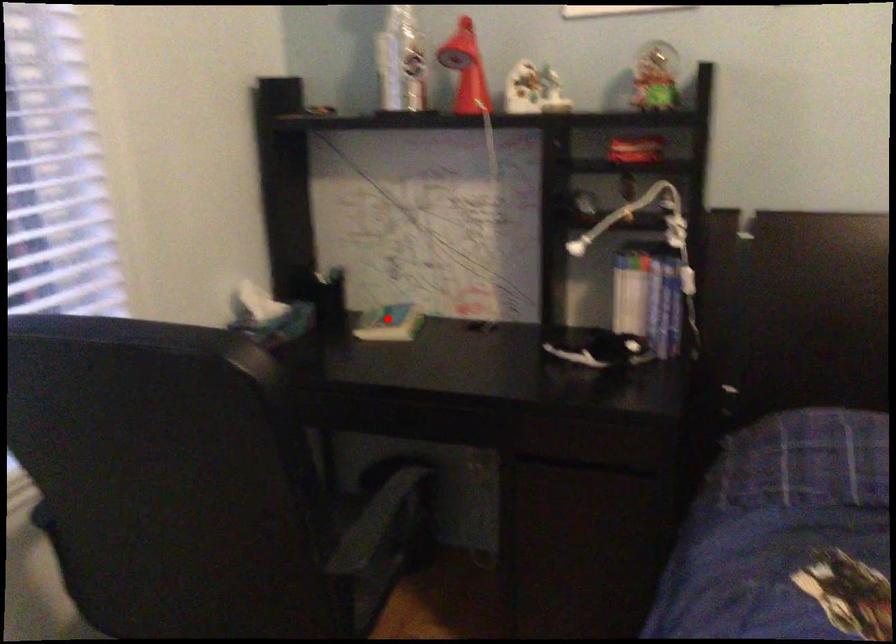
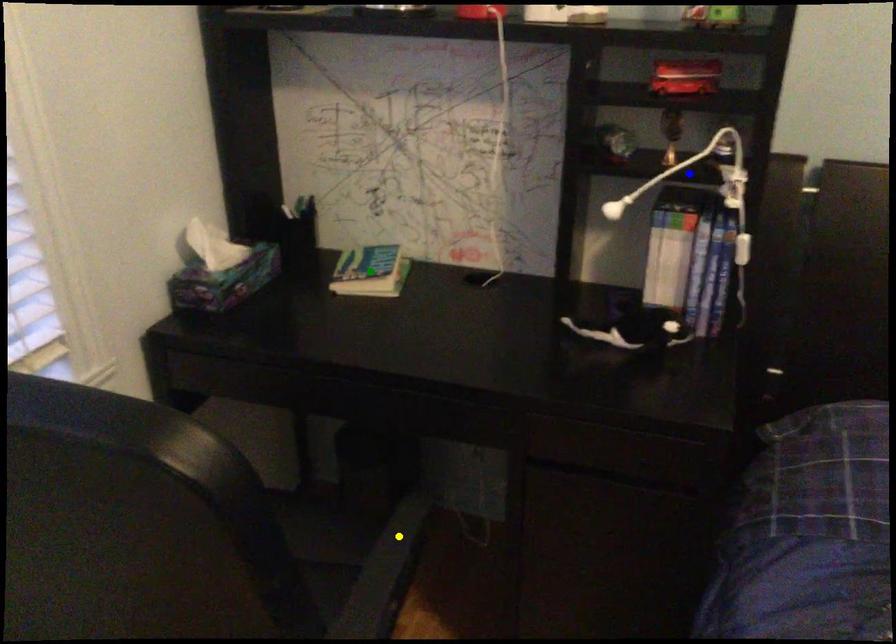
Question: I am providing you with two images of the same scene from different viewpoints. A red point is marked on the first image. You are given multiple points on the second image. Which spot in image 2 lines up with the point in image 1?

Choices:
 (A) blue point
 (B) yellow point
 (C) green point

Answer: (C)